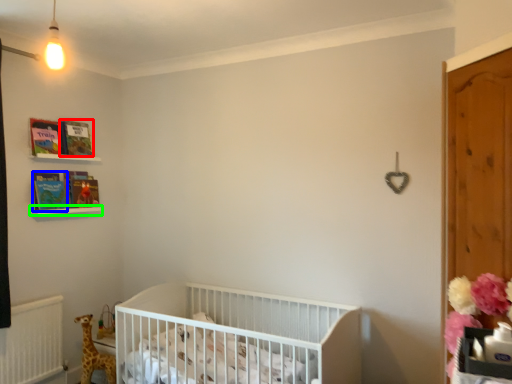
Question: Which is nearer to the book (highlighted by a red box)? book (highlighted by a blue box) or balustrade (highlighted by a green box).

Choices:
 (A) book
 (B) balustrade

Answer: (A)